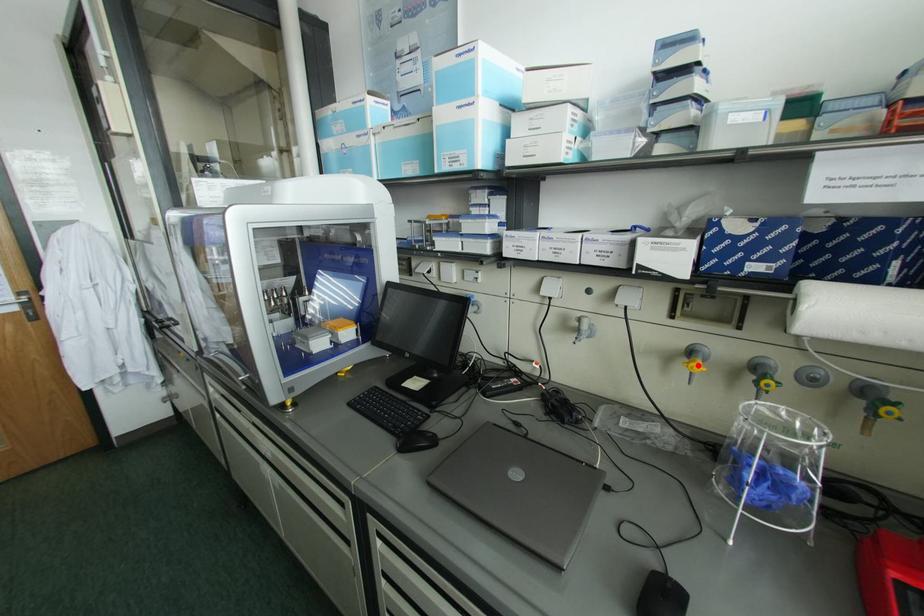
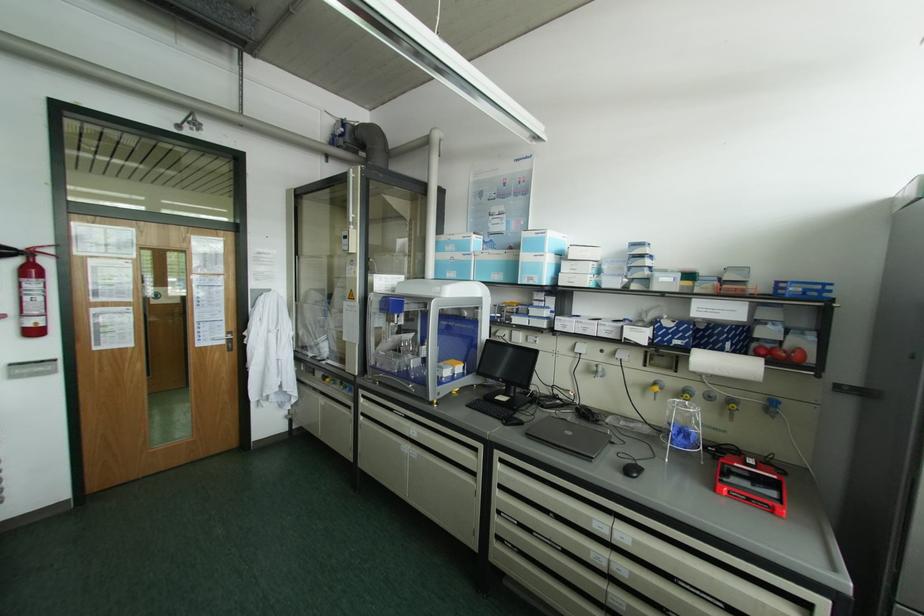
The point at the highlighted location is marked in the first image. Where is the corresponding point in the second image?

(655, 387)